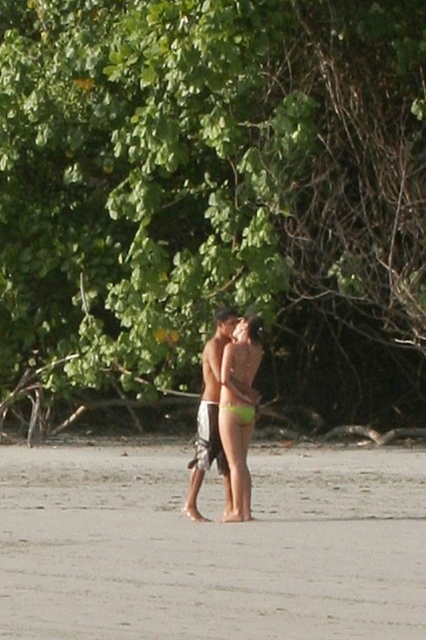
How distant is gray sand at center from green fabric bikini at center?

6.78 feet

What are the coordinates of `gray sand at center` in the screenshot? It's located at (212, 547).

Where is `gray sand at center`? gray sand at center is located at coordinates (212, 547).

Is green matte bikini bottom at center to the right of light brown textured shorts at center from the viewer's perspective?

Correct, you'll find green matte bikini bottom at center to the right of light brown textured shorts at center.

Is green matte bikini bottom at center behind light brown textured shorts at center?

No.

Which is behind, point (252, 380) or point (229, 499)?

The point (229, 499) is more distant.

Locate an element on the screen. green matte bikini bottom at center is located at coordinates (239, 410).

Between gray sand at center and light brown textured shorts at center, which one has more height?

light brown textured shorts at center is taller.

Which is behind, point (91, 602) or point (215, 394)?

The point (215, 394) is behind.

Identify the location of gray sand at center. The height and width of the screenshot is (640, 426). (212, 547).